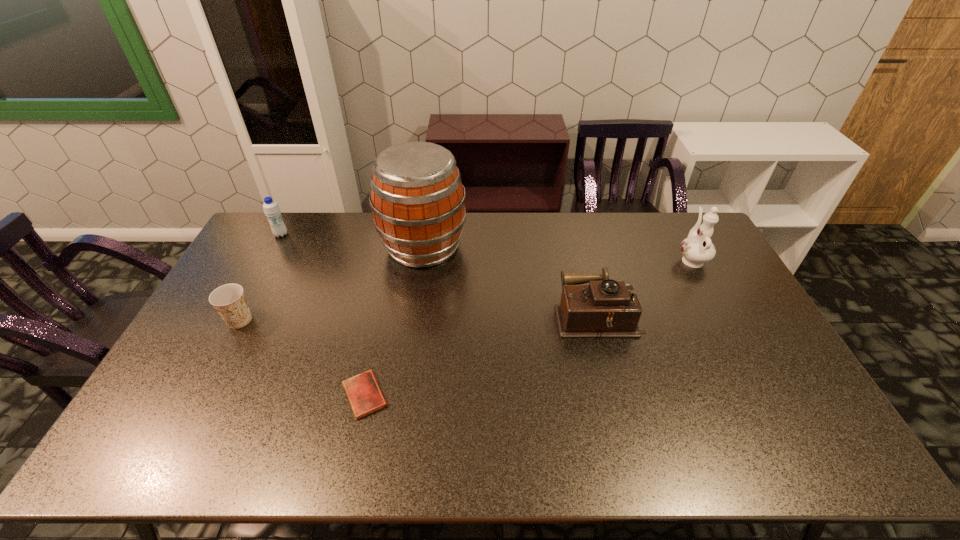
Locate an element on the screen. This screenshot has width=960, height=540. free space at the far right corner is located at coordinates (662, 225).

This screenshot has height=540, width=960. In order to click on free spot between the shortest object and the rightmost object in this screenshot , I will do `click(528, 327)`.

Locate an element on the screen. The width and height of the screenshot is (960, 540). empty location between the fifth shortest object and the cider is located at coordinates (558, 253).

Locate an element on the screen. This screenshot has height=540, width=960. vacant area that lies between the tallest object and the fifth tallest object is located at coordinates (331, 283).

The width and height of the screenshot is (960, 540). In order to click on vacant area that lies between the nearest object and the chinaware in this screenshot , I will do `click(528, 327)`.

Identify the location of free space that is in between the fifth tallest object and the shortest object. The height and width of the screenshot is (540, 960). (302, 357).

Find the location of `vacant point located between the nearest object and the fifth object from left to right`. vacant point located between the nearest object and the fifth object from left to right is located at coordinates (481, 355).

Image resolution: width=960 pixels, height=540 pixels. Find the location of `blank region between the Dixie cup and the chinaware`. blank region between the Dixie cup and the chinaware is located at coordinates [466, 289].

The image size is (960, 540). What are the coordinates of `vacant area that lies between the fifth shortest object and the cider` in the screenshot? It's located at (558, 253).

The width and height of the screenshot is (960, 540). Identify the location of unoccupied area between the second tallest object and the cider. (558, 253).